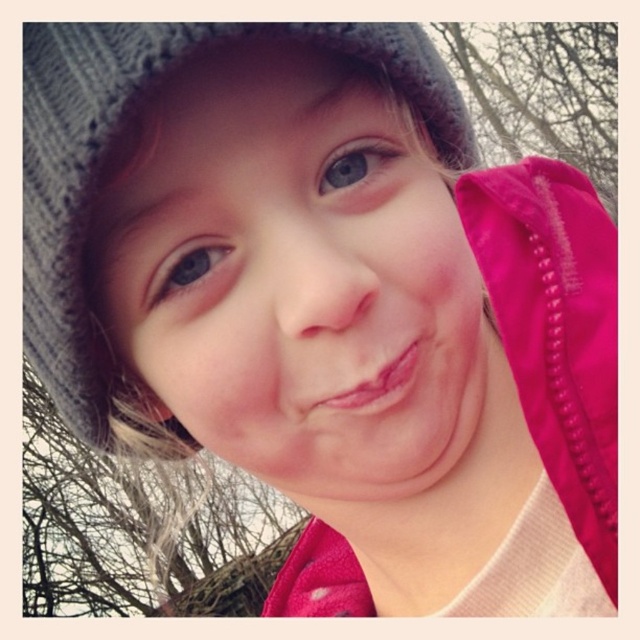
Who is positioned more to the left, blue matte eye at upper center or pink glossy lips at center?

Positioned to the left is pink glossy lips at center.

Locate an element on the screen. blue matte eye at upper center is located at coordinates (358, 163).

Identify the location of blue matte eye at upper center. The image size is (640, 640). click(358, 163).

Who is lower down, matte gray knit hat at center or blue matte eye at upper left?

Positioned lower is matte gray knit hat at center.

Is point (124, 161) positioned after point (202, 280)?

No, (124, 161) is in front of (202, 280).

I want to click on matte gray knit hat at center, so click(291, 275).

In the scene shown: Can you confirm if blue matte eye at upper left is wider than pink glossy lips at center?

Incorrect, blue matte eye at upper left's width does not surpass pink glossy lips at center's.

Consider the image. How far apart are blue matte eye at upper left and pink glossy lips at center?

They are 3.29 inches apart.

Who is more distant from viewer, (145, 289) or (369, 394)?

Positioned behind is point (145, 289).

Where is `blue matte eye at upper left`? This screenshot has height=640, width=640. blue matte eye at upper left is located at coordinates (188, 268).